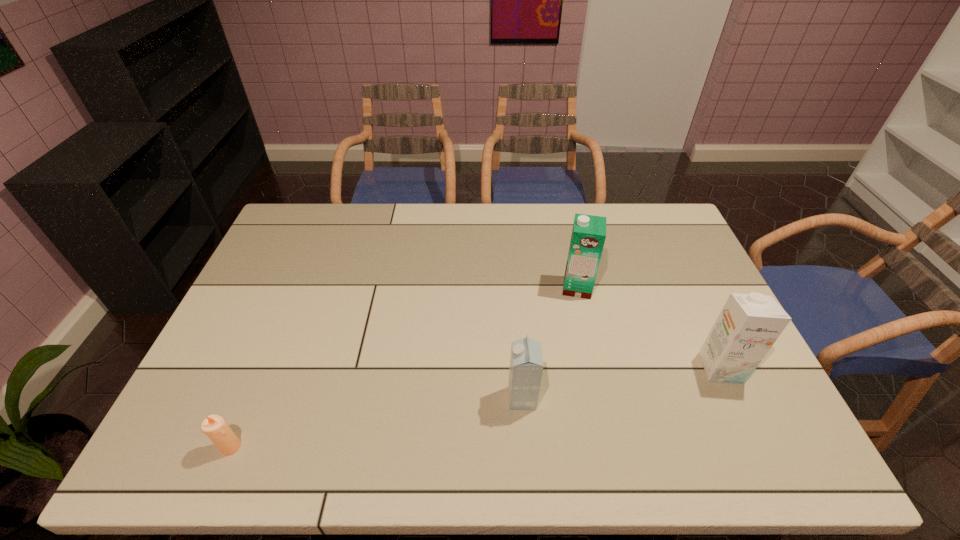
At what (x,y) coordinates should I click in order to perform the action: click on vacant area at the left edge of the desktop. Please return your answer as a coordinate pair (x, y). Image resolution: width=960 pixels, height=540 pixels. Looking at the image, I should click on (302, 258).

In the image, there is a desktop. Find the location of `vacant space at the right edge`. vacant space at the right edge is located at coordinates (681, 280).

Image resolution: width=960 pixels, height=540 pixels. In the image, there is a desktop. What are the coordinates of `vacant space at the far left corner` in the screenshot? It's located at (333, 210).

Where is `vacant region at the far right corner of the desktop`? This screenshot has width=960, height=540. vacant region at the far right corner of the desktop is located at coordinates (684, 242).

At what (x,y) coordinates should I click in order to perform the action: click on vacant space that is in between the shortest object and the second object from left to right. Please return your answer as a coordinate pair (x, y). This screenshot has width=960, height=540. Looking at the image, I should click on (376, 422).

Find the location of `free space between the second object from left to right and the rightmost carton`. free space between the second object from left to right and the rightmost carton is located at coordinates (621, 383).

Where is `vacant space in between the nearest carton and the nearest object`? Image resolution: width=960 pixels, height=540 pixels. vacant space in between the nearest carton and the nearest object is located at coordinates (376, 422).

Locate an element on the screen. Image resolution: width=960 pixels, height=540 pixels. free space between the third nearest object and the farthest object is located at coordinates (649, 328).

Identify the location of vacant area between the nearest object and the third nearest object. This screenshot has height=540, width=960. (476, 407).

Locate an element on the screen. The width and height of the screenshot is (960, 540). free space between the farthest carton and the second nearest object is located at coordinates (549, 343).